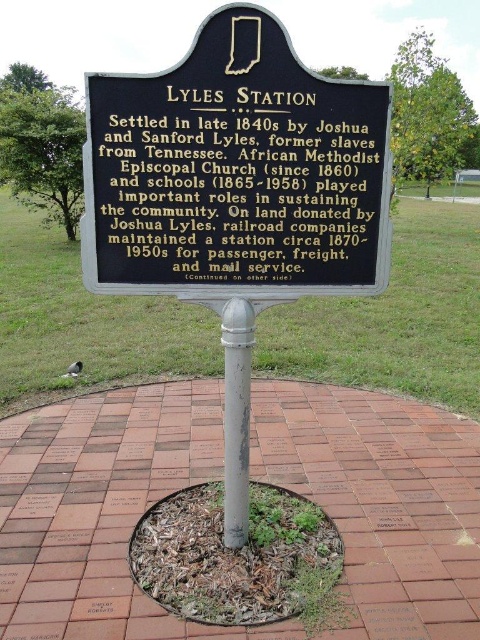
Can you confirm if black metal sign at center is wider than silver metallic pole at center?

Correct, the width of black metal sign at center exceeds that of silver metallic pole at center.

This screenshot has height=640, width=480. What do you see at coordinates (236, 172) in the screenshot? I see `black metal sign at center` at bounding box center [236, 172].

The image size is (480, 640). What do you see at coordinates (236, 172) in the screenshot?
I see `black metal sign at center` at bounding box center [236, 172].

You are a GUI agent. You are given a task and a screenshot of the screen. Output one action in this format:
    pyautogui.click(x=<x>, y=<y>)
    Task: Click on the black metal sign at center
    
    Given the screenshot: What is the action you would take?
    pyautogui.click(x=236, y=172)